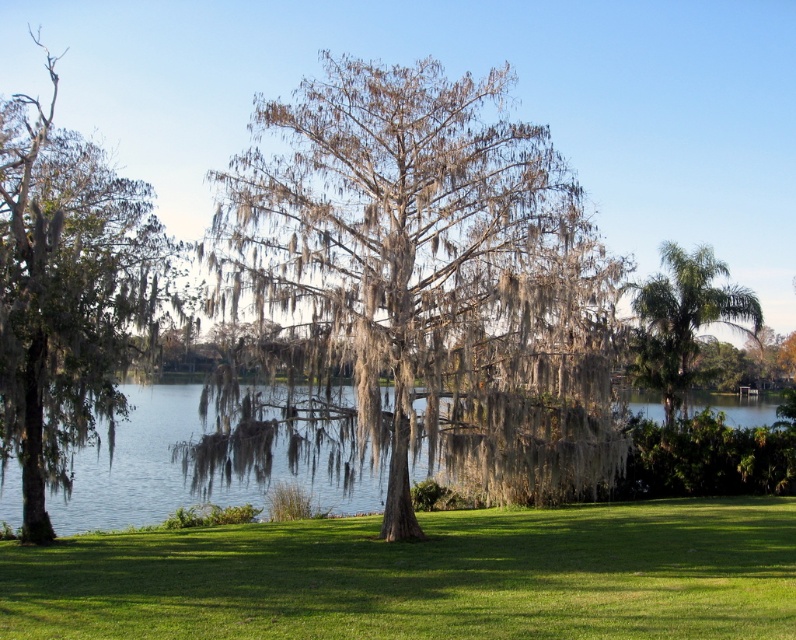
Question: Which of the following is the farthest from the observer?

Choices:
 (A) (38, 195)
 (B) (761, 317)

Answer: (B)

Question: Which of the following is the farthest from the observer?

Choices:
 (A) clear water at center
 (B) green leafy palm at right
 (C) green mossy tree at left

Answer: (B)

Question: Is green grass at center thinner than clear water at center?

Choices:
 (A) yes
 (B) no

Answer: (A)

Question: Based on their relative distances, which object is nearer to the grayish-brown moss-covered tree at center?

Choices:
 (A) green leafy palm at right
 (B) green grass at center

Answer: (B)

Question: Can you confirm if grayish-brown moss-covered tree at center is wider than green grass at center?

Choices:
 (A) no
 (B) yes

Answer: (A)

Question: Does green grass at center have a smaller size compared to green leafy palm at right?

Choices:
 (A) no
 (B) yes

Answer: (A)